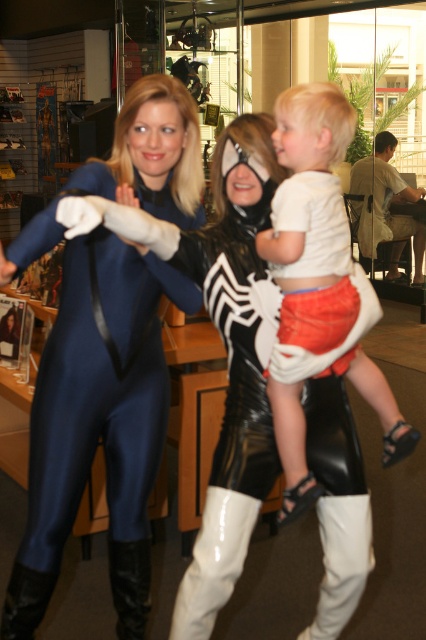
You are a costume designer preparing to alter the white cotton shirt at upper center and the black leather boot at lower center. Which of these two items requires more fabric to adjust for a better fit?

The white cotton shirt at upper center requires more fabric to adjust for a better fit since it is larger in size compared to the black leather boot at lower center.